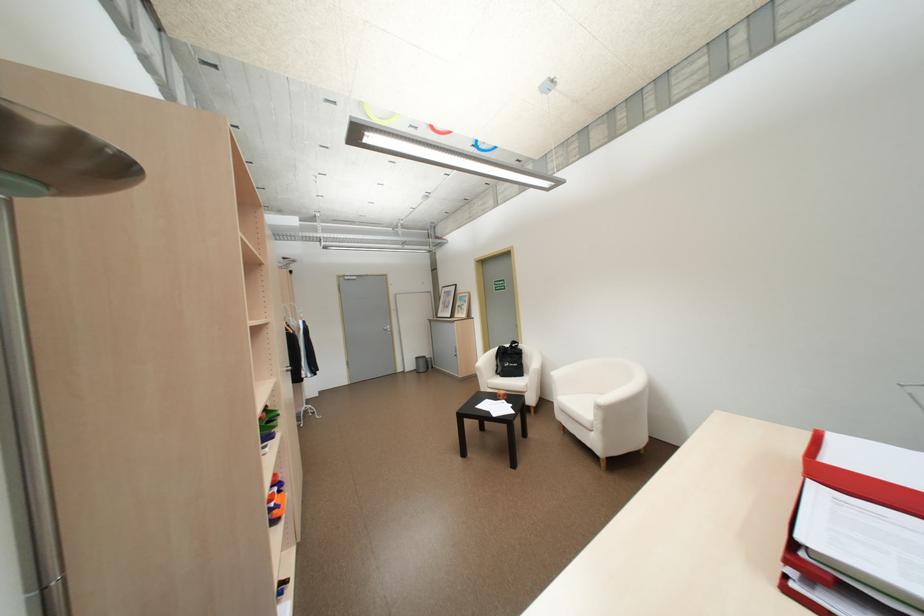
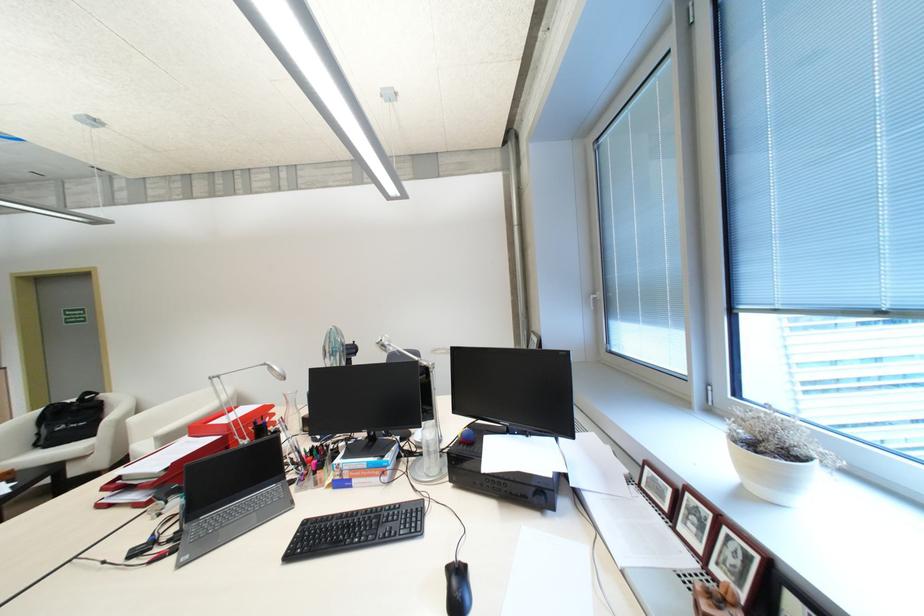
Locate, in the second image, the point that corresponds to (x=517, y=345) in the first image.

(82, 399)